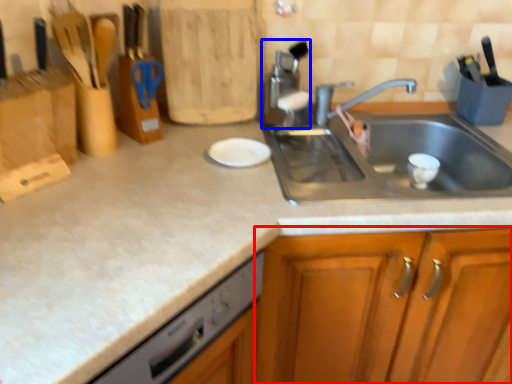
Question: Which object appears farthest to the camera in this image, cabinetry (highlighted by a red box) or appliance (highlighted by a blue box)?

Choices:
 (A) cabinetry
 (B) appliance

Answer: (B)